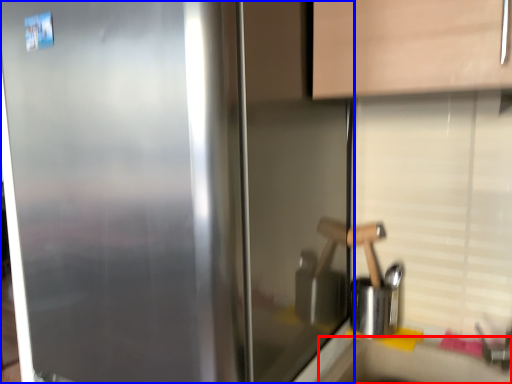
Question: Among these objects, which one is farthest to the camera, counter top (highlighted by a red box) or refrigerator (highlighted by a blue box)?

Choices:
 (A) counter top
 (B) refrigerator

Answer: (A)